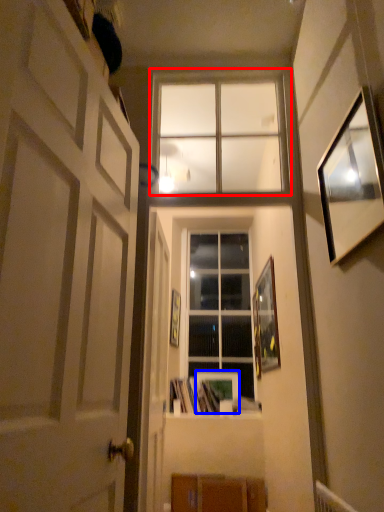
Question: Among these objects, which one is farthest to the camera, window (highlighted by a red box) or picture frame (highlighted by a blue box)?

Choices:
 (A) window
 (B) picture frame

Answer: (B)